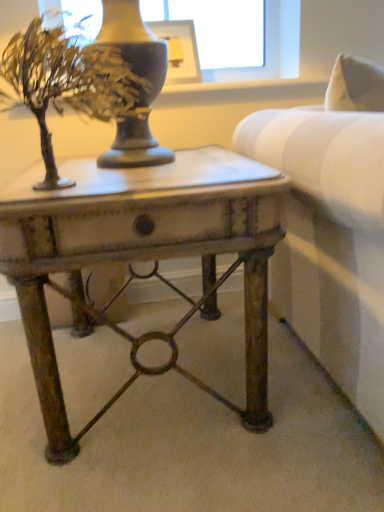
Question: From the image's perspective, would you say metallic gold tree at upper left is positioned over rustic metal table at center?

Choices:
 (A) yes
 (B) no

Answer: (A)

Question: Could you tell me if metallic gold tree at upper left is turned towards rustic metal table at center?

Choices:
 (A) yes
 (B) no

Answer: (B)

Question: Is metallic gold tree at upper left to the left of rustic metal table at center from the viewer's perspective?

Choices:
 (A) no
 (B) yes

Answer: (B)

Question: From a real-world perspective, is metallic gold tree at upper left under rustic metal table at center?

Choices:
 (A) yes
 (B) no

Answer: (B)

Question: Considering the relative sizes of metallic gold tree at upper left and rustic metal table at center in the image provided, is metallic gold tree at upper left taller than rustic metal table at center?

Choices:
 (A) no
 (B) yes

Answer: (A)

Question: Would you say rustic metal table at center is part of metallic gold tree at upper left's contents?

Choices:
 (A) no
 (B) yes

Answer: (A)

Question: Is metallic gold tree at upper left smaller than matte black picture frame at upper center?

Choices:
 (A) yes
 (B) no

Answer: (B)

Question: From a real-world perspective, does metallic gold tree at upper left stand above matte black picture frame at upper center?

Choices:
 (A) yes
 (B) no

Answer: (B)

Question: From a real-world perspective, is metallic gold tree at upper left below matte black picture frame at upper center?

Choices:
 (A) yes
 (B) no

Answer: (A)

Question: Can you confirm if metallic gold tree at upper left is shorter than matte black picture frame at upper center?

Choices:
 (A) no
 (B) yes

Answer: (A)

Question: Is matte black picture frame at upper center a part of metallic gold tree at upper left?

Choices:
 (A) yes
 (B) no

Answer: (B)

Question: Does metallic gold tree at upper left touch matte black picture frame at upper center?

Choices:
 (A) no
 (B) yes

Answer: (A)

Question: Is the depth of rustic metal table at center less than that of matte black picture frame at upper center?

Choices:
 (A) yes
 (B) no

Answer: (A)